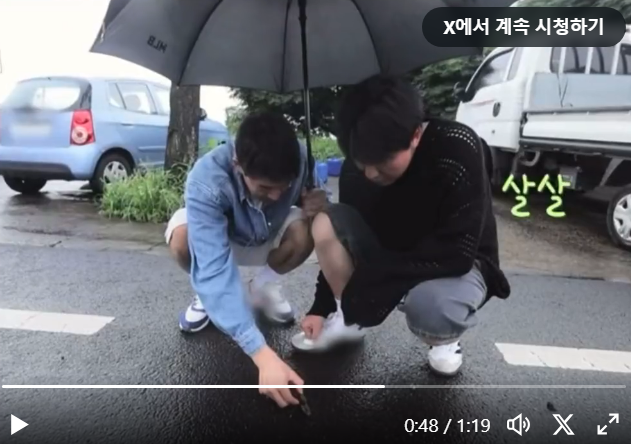
You are a GUI agent. You are given a task and a screenshot of the screen. Output one action in this format:
    pyautogui.click(x=<x>, y=<y>)
    Task: Click on the buttons on video player
    Image resolution: width=631 pixels, height=444 pixels.
    Given the screenshot: What is the action you would take?
    pyautogui.click(x=13, y=431), pyautogui.click(x=509, y=420), pyautogui.click(x=541, y=420), pyautogui.click(x=609, y=425)